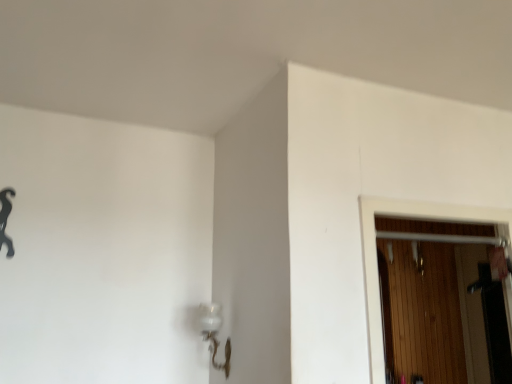
Question: Relative to clear glass lamp at lower center, is wooden at right in front or behind?

Choices:
 (A) front
 (B) behind

Answer: (A)

Question: In the image, is wooden at right on the left side or the right side of clear glass lamp at lower center?

Choices:
 (A) right
 (B) left

Answer: (A)

Question: Estimate the real-world distances between objects in this image. Which object is farther from the clear glass lamp at lower center?

Choices:
 (A) wooden at right
 (B) black matte hook at upper left

Answer: (A)

Question: Based on their relative distances, which object is farther from the black matte hook at upper left?

Choices:
 (A) wooden at right
 (B) clear glass lamp at lower center

Answer: (A)